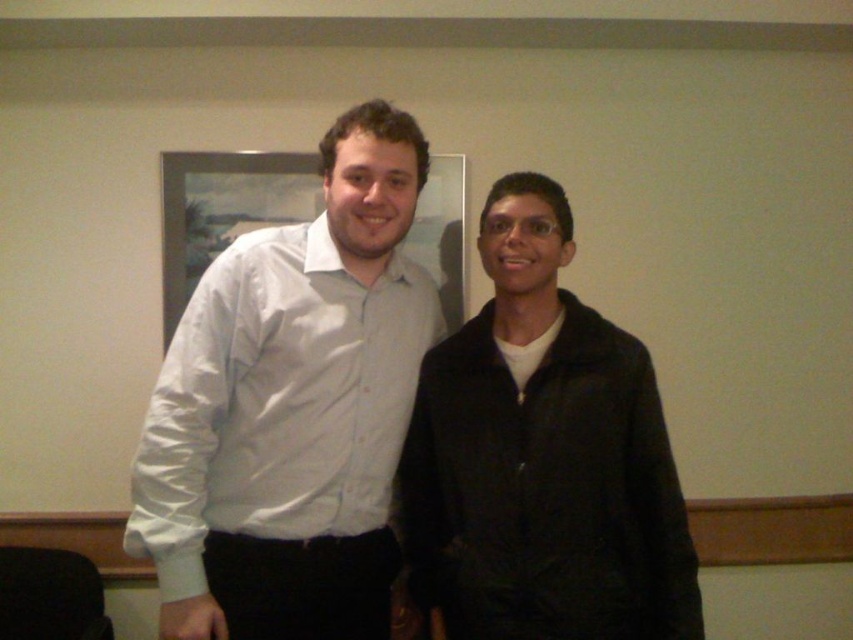
You are a photographer adjusting the camera focus. The black matte jacket at right and the white glossy frame at upper center are both in your viewfinder. Which object is wider in the image?

The black matte jacket at right is wider than the white glossy frame at upper center according to the description.

Consider the image. You are a photographer adjusting the camera settings to ensure both the white glossy shirt at center and the black matte jacket at right are in focus. Based on their positions, which object is taller and would require more vertical framing space?

The white glossy shirt at center is taller than the black matte jacket at right, so it would require more vertical framing space to ensure proper focus and composition.